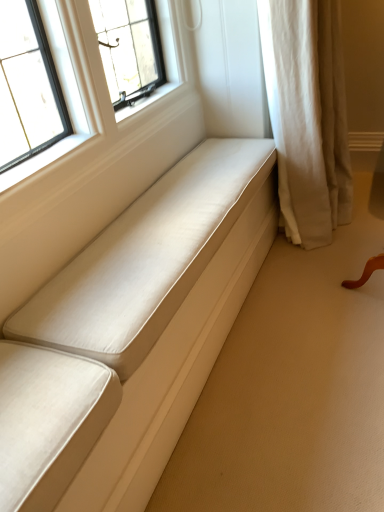
Question: Based on their sizes in the image, would you say matte white cushion at center is bigger or smaller than beige fabric curtain at right?

Choices:
 (A) small
 (B) big

Answer: (A)

Question: From the image's perspective, relative to beige fabric curtain at right, is matte white cushion at center above or below?

Choices:
 (A) above
 (B) below

Answer: (B)

Question: Considering the positions of point (16, 487) and point (324, 81), is point (16, 487) closer or farther from the camera than point (324, 81)?

Choices:
 (A) closer
 (B) farther

Answer: (A)

Question: From the image's perspective, is beige fabric curtain at right above or below matte white cushion at center?

Choices:
 (A) above
 (B) below

Answer: (A)

Question: Based on their sizes in the image, would you say beige fabric curtain at right is bigger or smaller than matte white cushion at center?

Choices:
 (A) small
 (B) big

Answer: (B)

Question: In terms of height, does beige fabric curtain at right look taller or shorter compared to matte white cushion at center?

Choices:
 (A) tall
 (B) short

Answer: (A)

Question: Is beige fabric curtain at right wider or thinner than matte white cushion at center?

Choices:
 (A) thin
 (B) wide

Answer: (B)